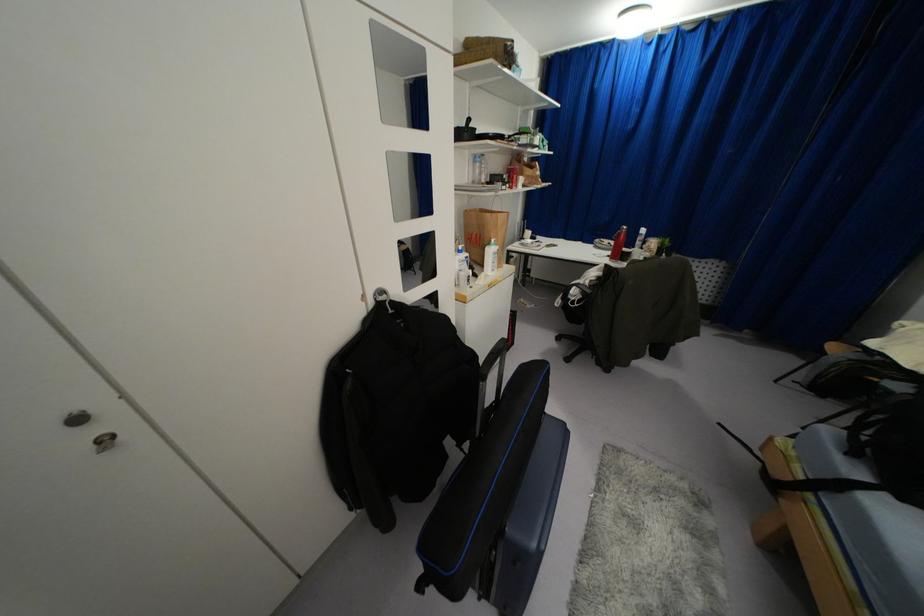
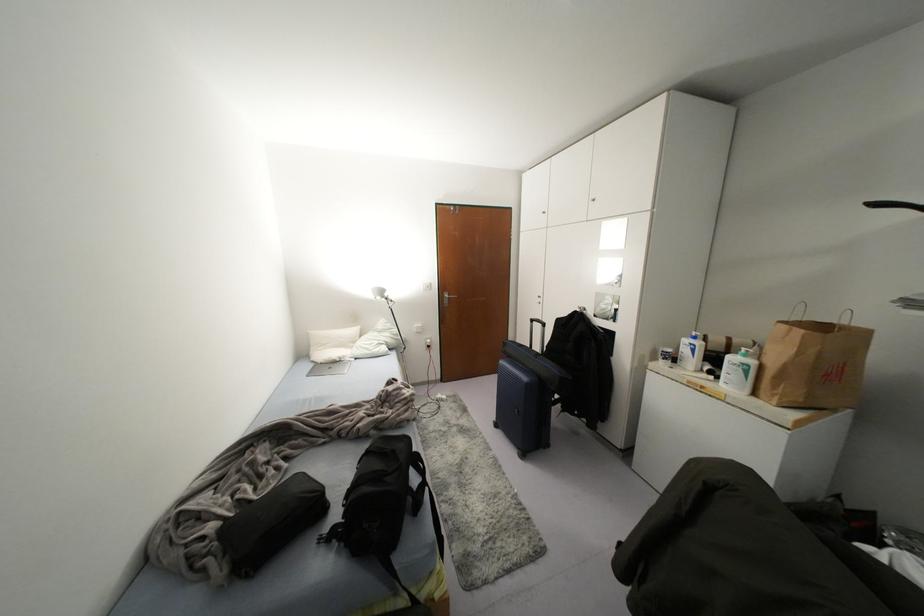
Locate, in the second image, the point that corresponds to point 495,246 in the first image.

(751, 362)